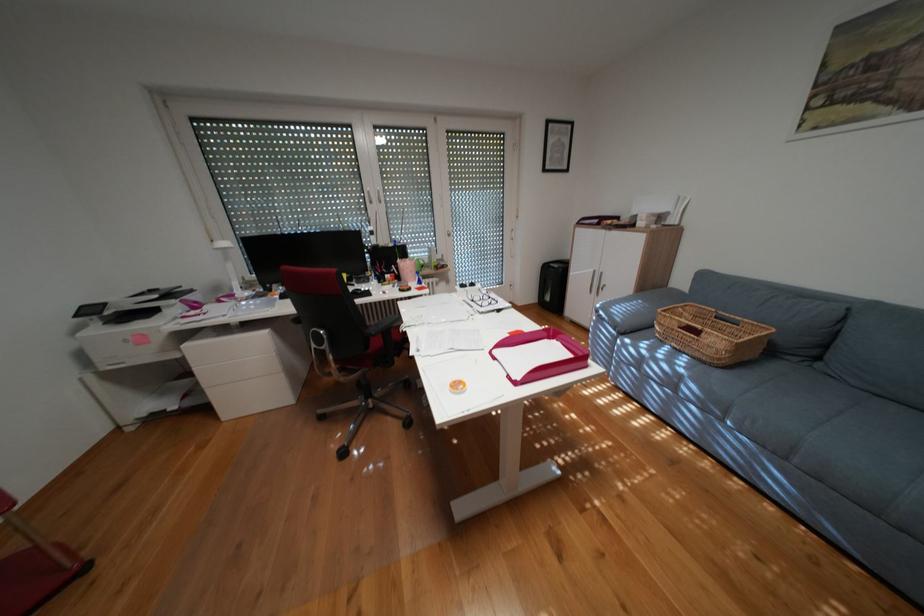
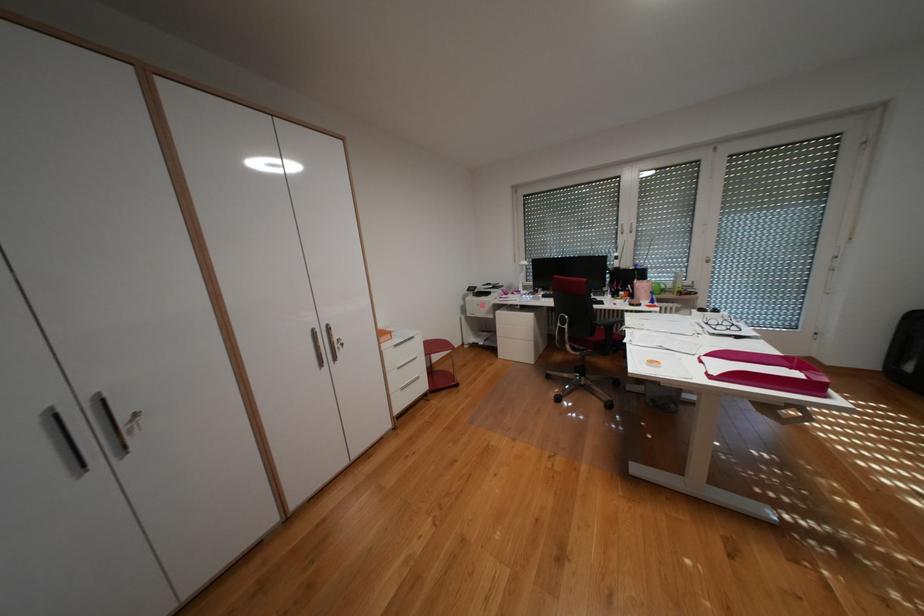
The point at (528, 382) is marked in the first image. Where is the corresponding point in the second image?

(723, 377)